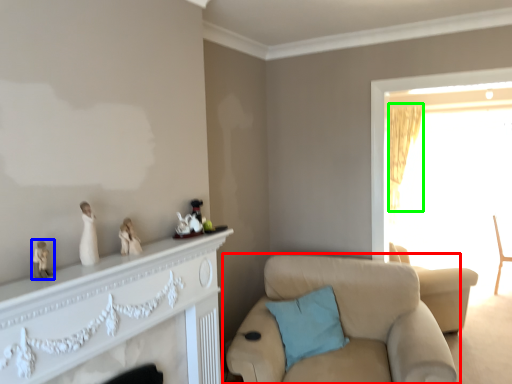
Question: Based on their relative distances, which object is nearer to chair (highlighted by a red box)? Choose from toy (highlighted by a blue box) and curtain (highlighted by a green box).

Choices:
 (A) toy
 (B) curtain

Answer: (A)